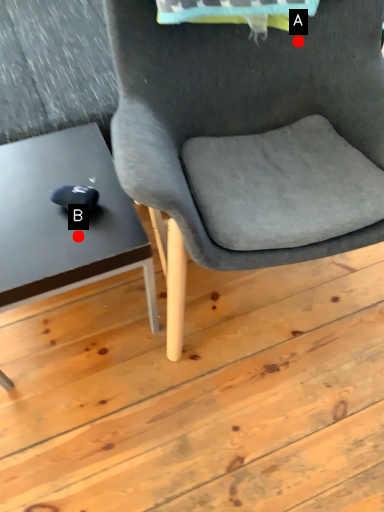
Question: Two points are circled on the image, labeled by A and B beside each circle. Which point appears farthest from the camera in this image?

Choices:
 (A) A is further
 (B) B is further

Answer: (A)